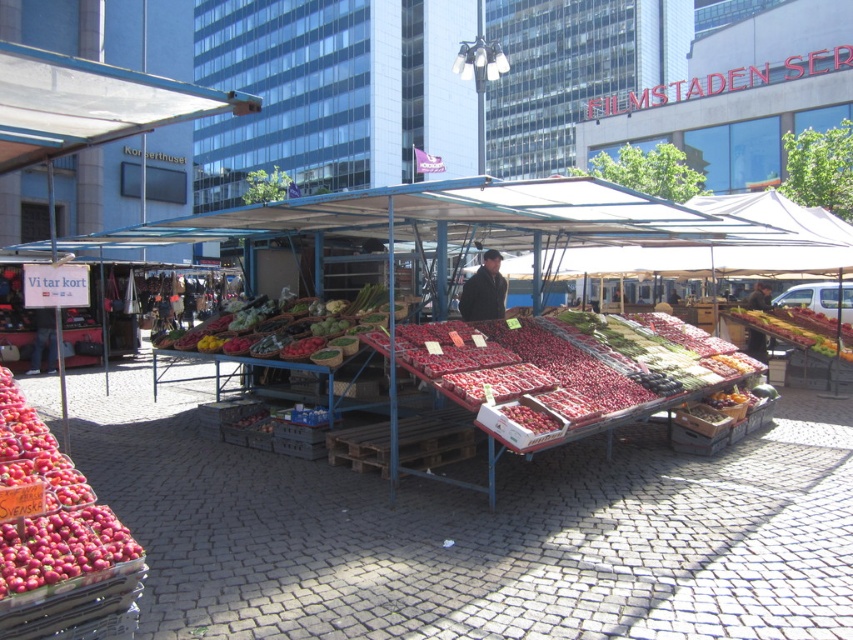
Question: Which is farther from the shiny red tomatoes at center?

Choices:
 (A) red matte apples at lower left
 (B) shiny red strawberries at center
 (C) dark brown leather jacket at center
 (D) shiny plastic strawberries at center

Answer: (B)

Question: Which point appears closest to the camera in this image?

Choices:
 (A) (459, 308)
 (B) (381, 289)
 (C) (833, 346)
 (D) (392, 275)

Answer: (B)

Question: Is red matte apples at lower left smaller than shiny red strawberries at center?

Choices:
 (A) yes
 (B) no

Answer: (A)

Question: Which object is the closest to the red matte apples at lower left?

Choices:
 (A) dark brown leather jacket at center
 (B) shiny red tomatoes at center

Answer: (B)

Question: Can you confirm if red matte apples at lower left is bigger than dark brown leather jacket at center?

Choices:
 (A) no
 (B) yes

Answer: (B)

Question: Is shiny plastic strawberries at center to the left of red matte apples at lower left from the viewer's perspective?

Choices:
 (A) yes
 (B) no

Answer: (B)